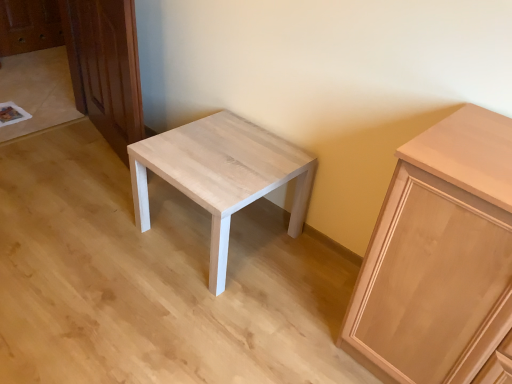
Question: Is light brown wood dresser at left oriented away from light wood/texture stool at center?

Choices:
 (A) yes
 (B) no

Answer: (B)

Question: Is light brown wood dresser at left aimed at light wood/texture stool at center?

Choices:
 (A) no
 (B) yes

Answer: (A)

Question: Considering the relative positions of light brown wood dresser at left and light wood/texture stool at center in the image provided, is light brown wood dresser at left to the right of light wood/texture stool at center from the viewer's perspective?

Choices:
 (A) yes
 (B) no

Answer: (B)

Question: Is light brown wood dresser at left behind light wood/texture stool at center?

Choices:
 (A) no
 (B) yes

Answer: (B)

Question: Is light brown wood dresser at left completely or partially outside of light wood/texture stool at center?

Choices:
 (A) yes
 (B) no

Answer: (A)

Question: Is light brown wood dresser at left wider than light wood/texture stool at center?

Choices:
 (A) no
 (B) yes

Answer: (A)

Question: From the image's perspective, is light wood/texture stool at center above light brown wood cabinet at right?

Choices:
 (A) no
 (B) yes

Answer: (B)

Question: Is light wood/texture stool at center far away from light brown wood cabinet at right?

Choices:
 (A) no
 (B) yes

Answer: (A)

Question: From a real-world perspective, is light wood/texture stool at center below light brown wood cabinet at right?

Choices:
 (A) no
 (B) yes

Answer: (B)

Question: Is light wood/texture stool at center outside of light brown wood cabinet at right?

Choices:
 (A) yes
 (B) no

Answer: (A)

Question: Is light wood/texture stool at center aimed at light brown wood cabinet at right?

Choices:
 (A) yes
 (B) no

Answer: (B)

Question: Can you confirm if light wood/texture stool at center is positioned to the left of light brown wood cabinet at right?

Choices:
 (A) yes
 (B) no

Answer: (A)

Question: Does light wood/texture stool at center have a greater height compared to light brown wood dresser at left?

Choices:
 (A) no
 (B) yes

Answer: (A)